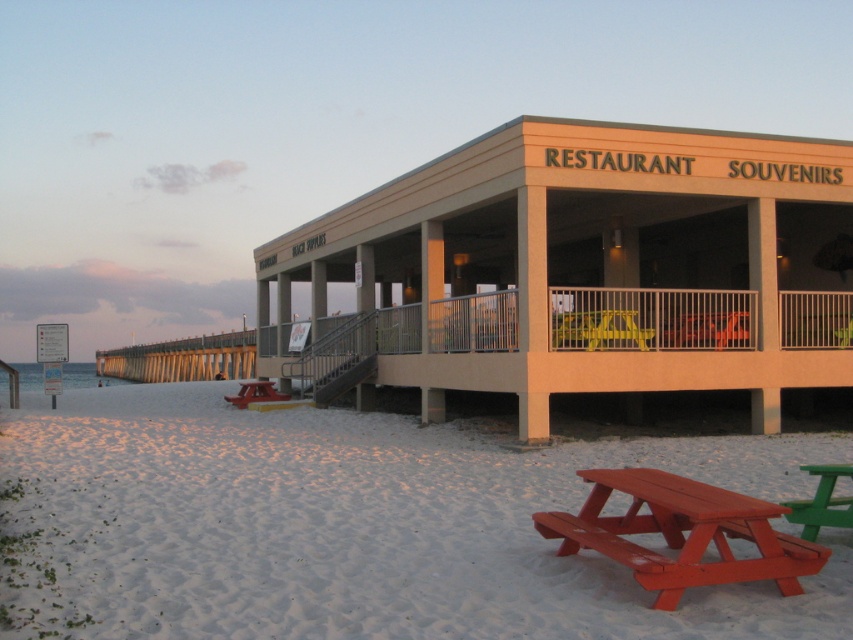
Is point (608, 458) farther from camera compared to point (811, 524)?

Yes.

Does white sandy beach at lower left lie behind green plastic bench at lower right?

No, it is in front of green plastic bench at lower right.

Locate an element on the screen. white sandy beach at lower left is located at coordinates pyautogui.click(x=351, y=525).

Which is below, white sandy beach at lower left or matte red bench at lower left?

Positioned lower is matte red bench at lower left.

Who is more forward, [790,602] or [253,387]?

Point [790,602] is more forward.

This screenshot has width=853, height=640. Identify the location of white sandy beach at lower left. (351, 525).

Is red wood picnic table at lower right smaller than matte red bench at lower left?

Indeed, red wood picnic table at lower right has a smaller size compared to matte red bench at lower left.

Which of these two, red wood picnic table at lower right or matte red bench at lower left, stands taller?

matte red bench at lower left is taller.

This screenshot has height=640, width=853. Identify the location of red wood picnic table at lower right. (682, 532).

Identify the location of red wood picnic table at lower right. (682, 532).